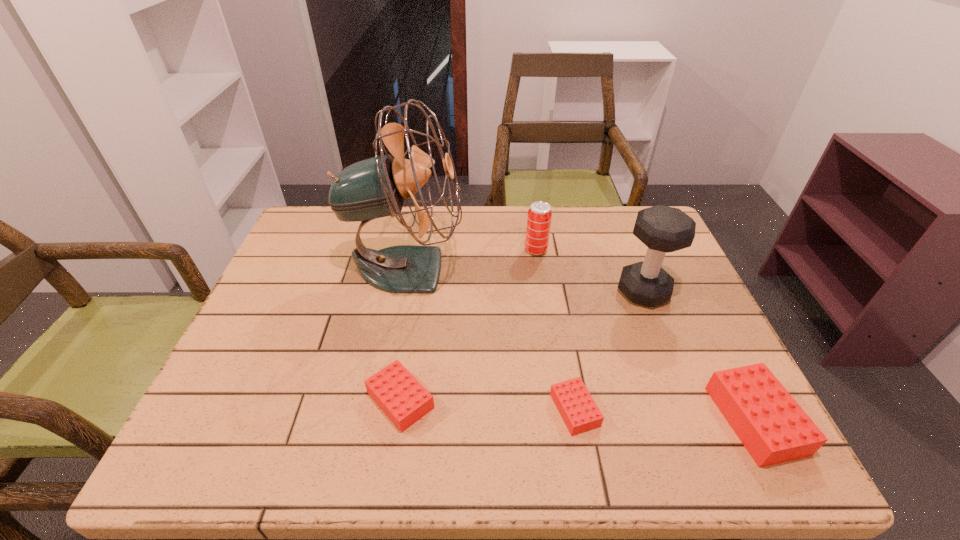
I want to click on vacant area that lies between the fourth tallest object and the shortest Lego, so click(665, 415).

In order to click on free spot between the tallest object and the second shortest Lego in this screenshot , I will do `click(403, 334)`.

This screenshot has width=960, height=540. What are the coordinates of `vacant space that is in between the shortest Lego and the second shortest Lego` in the screenshot? It's located at [x=488, y=405].

The height and width of the screenshot is (540, 960). I want to click on free spot between the fourth shortest object and the second tallest object, so click(x=589, y=271).

The height and width of the screenshot is (540, 960). In order to click on free space between the dumbbell and the fifth tallest object in this screenshot , I will do `click(522, 346)`.

Locate an element on the screen. vacant space in between the rightmost Lego and the shortest Lego is located at coordinates tap(665, 415).

At what (x,y) coordinates should I click in order to perform the action: click on unoccupied area between the second tallest object and the second Lego from right to left. Please return your answer as a coordinate pair (x, y). The height and width of the screenshot is (540, 960). Looking at the image, I should click on (609, 350).

I want to click on free point between the second shortest object and the dumbbell, so click(x=522, y=346).

Find the location of a particular element. The height and width of the screenshot is (540, 960). object that is the third closest to the second shortest object is located at coordinates (539, 217).

Select which object appears as the third closest to the fifth shortest object. Please provide its 2D coordinates. Your answer should be formatted as a tuple, i.e. [(x, y)], where the tuple contains the x and y coordinates of a point satisfying the conditions above.

[(575, 404)]